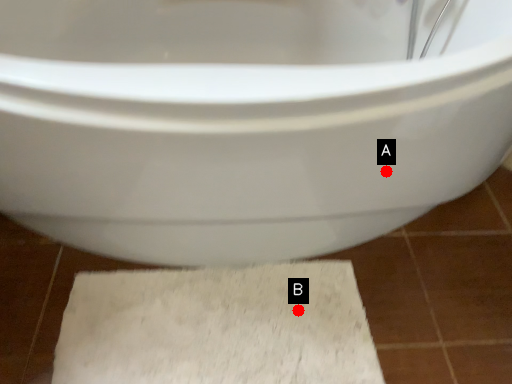
Question: Two points are circled on the image, labeled by A and B beside each circle. Which point appears farthest from the camera in this image?

Choices:
 (A) A is further
 (B) B is further

Answer: (B)